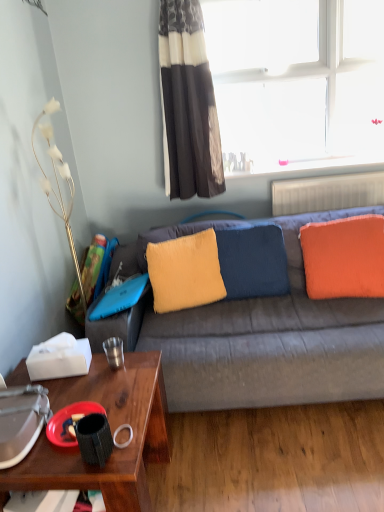
Question: Does point (192, 68) appear closer or farther from the camera than point (107, 361)?

Choices:
 (A) closer
 (B) farther

Answer: (B)

Question: From a real-world perspective, relative to metallic silver cup at lower left, which is the 2th coffee cup in bottom-to-top order, is black and white striped curtain at upper center vertically above or below?

Choices:
 (A) below
 (B) above

Answer: (B)

Question: Considering the real-world distances, which object is closest to the black textured coffee cup at lower left, the first coffee cup in the bottom-to-top sequence?

Choices:
 (A) orange soft cushion at right, the 1th pillow viewed from the right
 (B) metallic silver cup at lower left, marked as the 2th coffee cup in a front-to-back arrangement
 (C) fuzzy yellow pillow at center, arranged as the third pillow when viewed from the right
 (D) white plastic radiator at upper right
 (E) white metallic lamp at left

Answer: (B)

Question: Estimate the real-world distances between objects in this image. Which object is closer to the velvety yellow pillow at center, which is the 2th pillow in right-to-left order?

Choices:
 (A) black textured coffee cup at lower left, the first coffee cup in the bottom-to-top sequence
 (B) fuzzy yellow pillow at center, marked as the 1th pillow in a left-to-right arrangement
 (C) metallic silver cup at lower left, the 1th coffee cup positioned from the back
 (D) transparent glass window at upper right
 (E) white metallic lamp at left

Answer: (B)